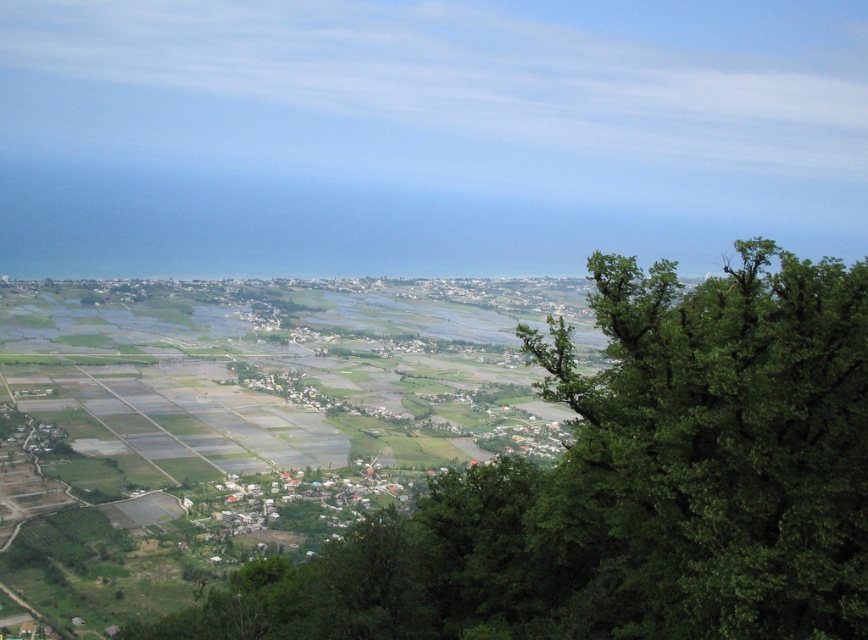
You are standing in the rural landscape and want to walk towards the green leafy tree at right. Which direction should you move relative to the green leafy tree at center?

You should move towards the right side of the green leafy tree at center because the green leafy tree at right is positioned to its right and further away from you.